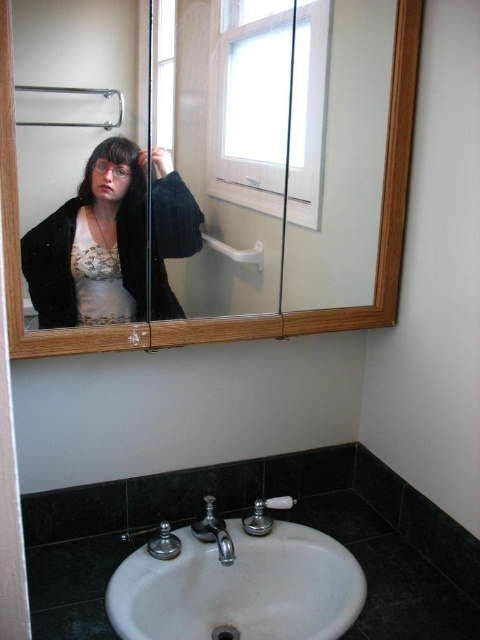
Can you confirm if white glossy sink at lower center is shorter than satin nickel faucet at sink center?

Incorrect, white glossy sink at lower center's height does not fall short of satin nickel faucet at sink center's.

Who is shorter, white glossy sink at lower center or satin nickel faucet at sink center?

satin nickel faucet at sink center

Identify the location of white glossy sink at lower center. This screenshot has width=480, height=640. (237, 582).

In the scene shown: Can you confirm if white glossy sink at lower center is thinner than matte black sweater at upper left?

No.

Who is more distant from viewer, (259,544) or (199,234)?

Positioned behind is point (259,544).

Find the location of `white glossy sink at lower center`. white glossy sink at lower center is located at coordinates (237, 582).

Is point (204, 340) closer to camera compared to point (225, 547)?

No, (204, 340) is behind (225, 547).

Does wooden cabinet at upper center have a smaller size compared to satin nickel faucet at sink center?

No.

Locate an element on the screen. This screenshot has height=640, width=480. wooden cabinet at upper center is located at coordinates coord(226,317).